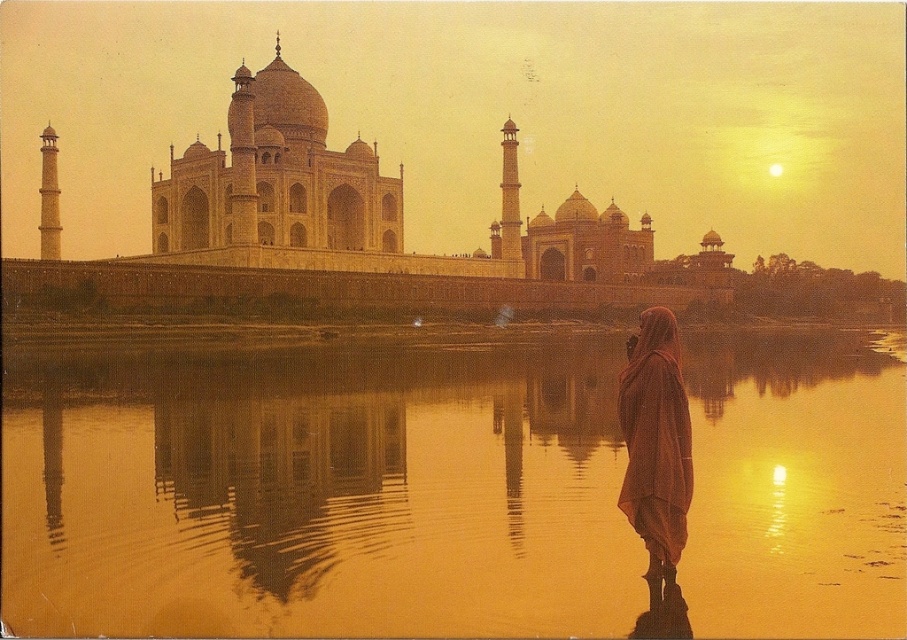
Between smooth golden water at center and silky brown scarf at lower right, which one appears on the left side from the viewer's perspective?

smooth golden water at center

Who is more forward, (724,413) or (646,422)?

Point (646,422) is more forward.

Find the location of a particular element. smooth golden water at center is located at coordinates (318, 493).